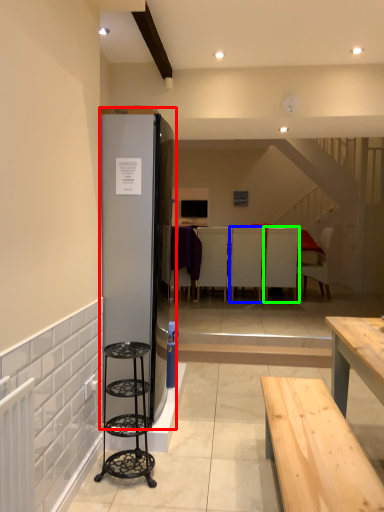
Question: Which object is positioned farthest from fridge (highlighted by a red box)? Select from armchair (highlighted by a blue box) and armchair (highlighted by a green box).

Choices:
 (A) armchair
 (B) armchair

Answer: (B)